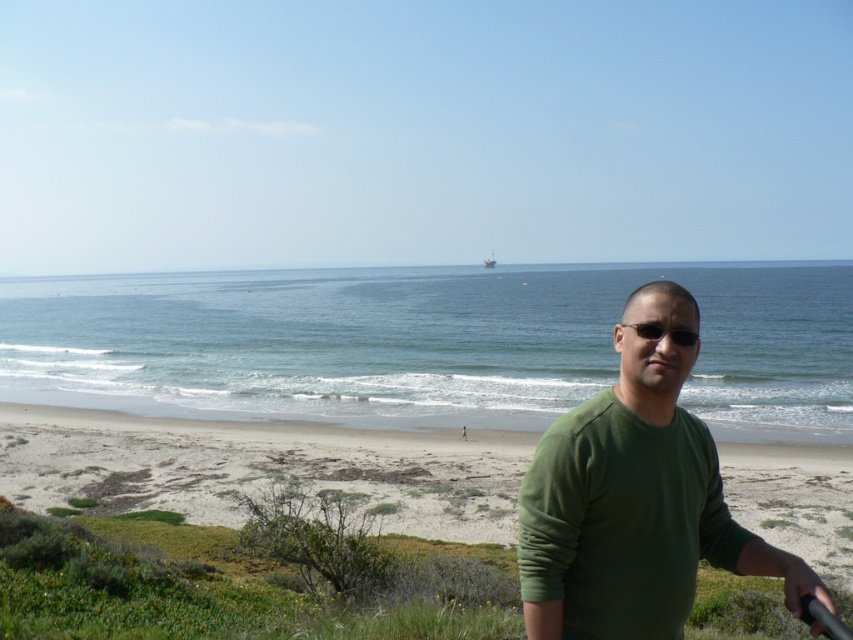
You are a photographer standing on the beach and want to take a photo of the green matte sweater at center. If your camera can focus on objects up to 3 meters away, will you be able to capture the sweater clearly?

The green matte sweater at center is 2.56 meters away from the camera, which is within the camera focus range of up to 3 meters. Therefore, the sweater can be captured clearly.

You are standing at the point marked as point (262, 467) on the beach. Looking around, you see the smooth sand beach at center. Which direction should you walk to reach the smooth sand beach at center?

You are already at the smooth sand beach at center located at point (262, 467), so you don not need to walk anywhere else.

You are a photographer trying to capture the perfect shot of the beach scene. You notice the green matte sweater at center and the black plastic sunglasses at center. Which object is positioned to the left of the other?

The green matte sweater at center is to the left of the black plastic sunglasses at center.